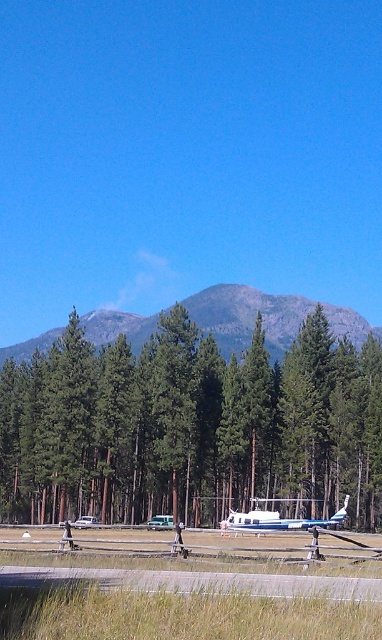
Does green matte tree at center have a smaller size compared to gray/dull stone mountain at center?

Indeed, green matte tree at center has a smaller size compared to gray/dull stone mountain at center.

Is green matte tree at center below gray/dull stone mountain at center?

Correct, green matte tree at center is located below gray/dull stone mountain at center.

Which is in front, point (53, 513) or point (257, 292)?

Point (53, 513)

The image size is (382, 640). Identify the location of green matte tree at center. (191, 426).

Between gray/dull stone mountain at center and metallic blue airplane at center, which one has more height?

With more height is gray/dull stone mountain at center.

In the scene shown: Who is more distant from viewer, (158, 316) or (330, 518)?

Point (158, 316)

The width and height of the screenshot is (382, 640). What do you see at coordinates (247, 316) in the screenshot? I see `gray/dull stone mountain at center` at bounding box center [247, 316].

In order to click on gray/dull stone mountain at center in this screenshot , I will do `click(247, 316)`.

Who is more forward, (296, 328) or (139, 582)?

Point (139, 582) is in front.

Does gray/dull stone mountain at center appear under gray concrete runway at lower center?

No, gray/dull stone mountain at center is not below gray concrete runway at lower center.

Does point (278, 305) come farther from viewer compared to point (1, 586)?

Yes, point (278, 305) is farther from viewer.

The width and height of the screenshot is (382, 640). I want to click on gray/dull stone mountain at center, so click(247, 316).